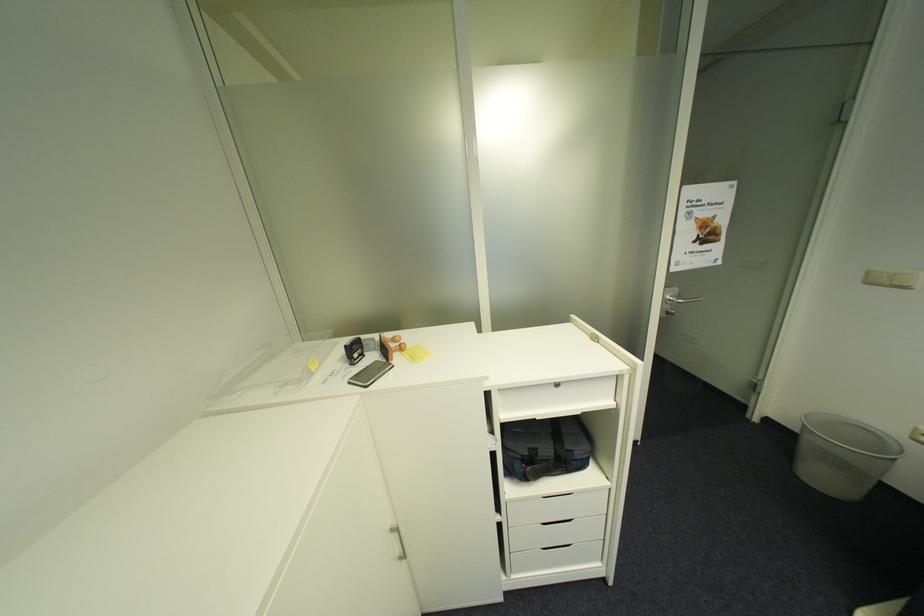
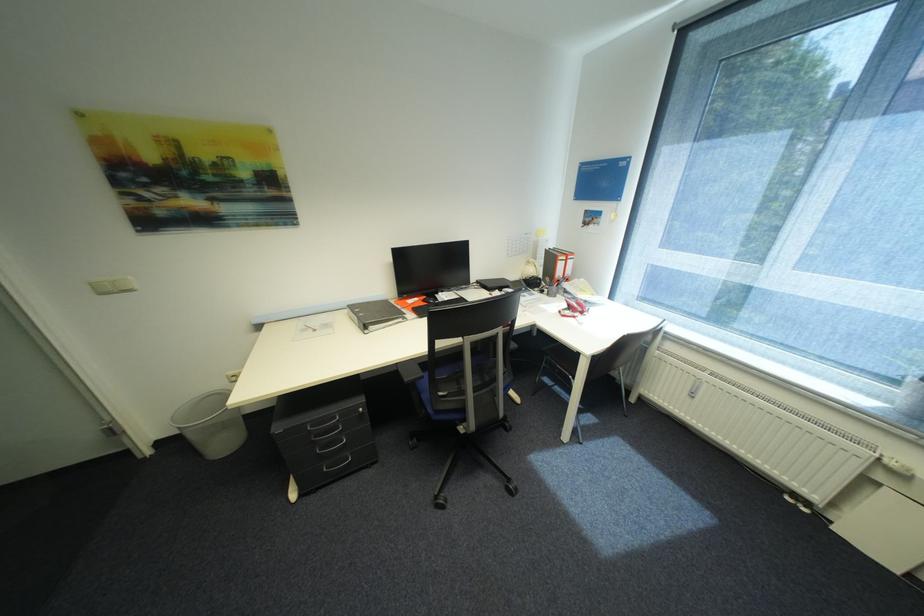
The images are taken continuously from a first-person perspective. In which direction is your viewpoint rotating?

The rotation direction of the camera is right-down.